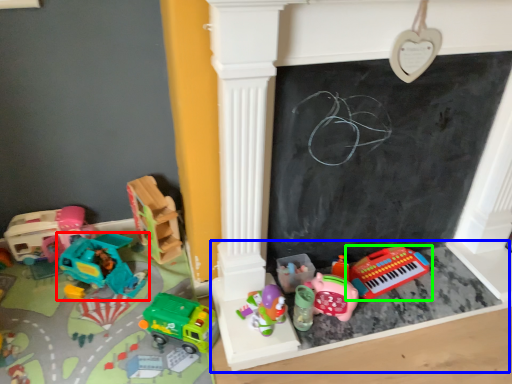
Question: Considering the real-world distances, which object is closest to toy (highlighted by a red box)? furniture (highlighted by a blue box) or toy (highlighted by a green box).

Choices:
 (A) furniture
 (B) toy

Answer: (A)